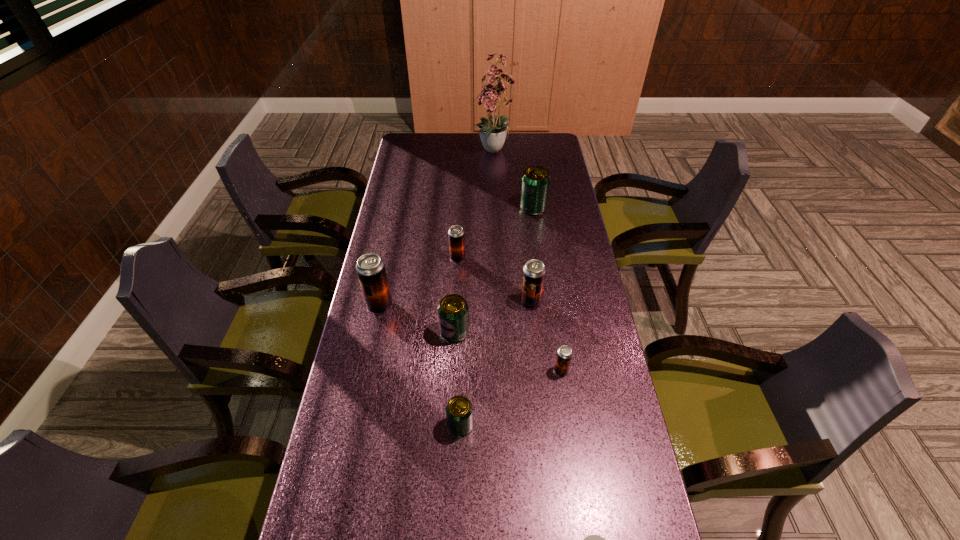
This screenshot has width=960, height=540. I want to click on free spot located on the left of the second smallest green beer can, so click(407, 332).

Where is `free point located 0.150m on the right of the nearest beer can`? The height and width of the screenshot is (540, 960). free point located 0.150m on the right of the nearest beer can is located at coordinates (532, 425).

Image resolution: width=960 pixels, height=540 pixels. In order to click on vacant space situated 0.120m on the front of the smallest black beer can in this screenshot , I will do `click(568, 417)`.

Locate an element on the screen. The height and width of the screenshot is (540, 960). object situated at the far edge is located at coordinates (493, 132).

Identify the location of object located at the left edge. This screenshot has height=540, width=960. (370, 268).

Where is `blank space at the far edge of the desktop`? Image resolution: width=960 pixels, height=540 pixels. blank space at the far edge of the desktop is located at coordinates (490, 154).

In the image, there is a desktop. Where is `free space at the left edge`? Image resolution: width=960 pixels, height=540 pixels. free space at the left edge is located at coordinates (392, 360).

Locate an element on the screen. vacant position at the right edge of the desktop is located at coordinates (606, 372).

Find the location of a particular element. vacant region at the far left corner of the desktop is located at coordinates (431, 132).

Image resolution: width=960 pixels, height=540 pixels. I want to click on vacant space at the far right corner of the desktop, so click(x=545, y=145).